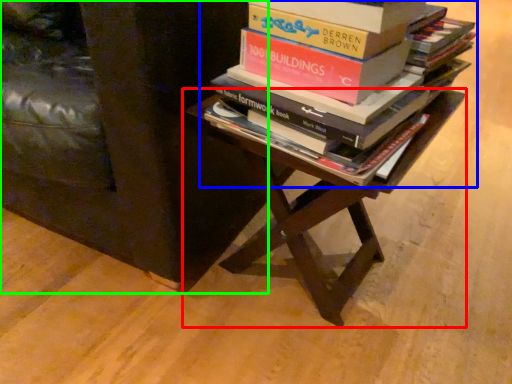
Question: Based on their relative distances, which object is nearer to table (highlighted by a red box)? Choose from book (highlighted by a blue box) and furniture (highlighted by a green box).

Choices:
 (A) book
 (B) furniture

Answer: (A)